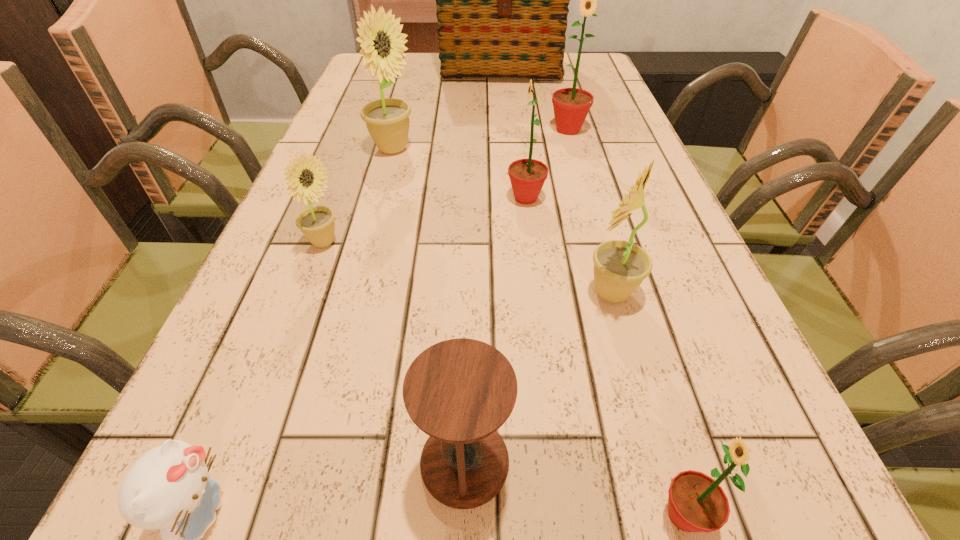
Identify the location of hourglass. (460, 391).

Identify the location of free region located on the open handle side of the shopping bag. (503, 109).

Find the location of `free spot located 0.310m on the face of the biggest yellow sunflower`. free spot located 0.310m on the face of the biggest yellow sunflower is located at coordinates (550, 149).

The image size is (960, 540). Identify the location of free region located on the face of the farthest green sunflower. (587, 193).

Locate an element on the screen. free space located on the face of the second smallest yellow sunflower is located at coordinates (478, 292).

Where is `vacant area situated on the face of the second smallest yellow sunflower`? The width and height of the screenshot is (960, 540). vacant area situated on the face of the second smallest yellow sunflower is located at coordinates (x=447, y=292).

Where is `vacant space situated 0.300m on the face of the second smallest yellow sunflower`? This screenshot has height=540, width=960. vacant space situated 0.300m on the face of the second smallest yellow sunflower is located at coordinates (398, 292).

I want to click on free space located 0.070m on the face of the second smallest green sunflower, so click(472, 198).

Where is `vacant area situated on the face of the second smallest green sunflower`? vacant area situated on the face of the second smallest green sunflower is located at coordinates (319, 198).

Where is `vacant space situated on the face of the second smallest green sunflower`? The image size is (960, 540). vacant space situated on the face of the second smallest green sunflower is located at coordinates (452, 198).